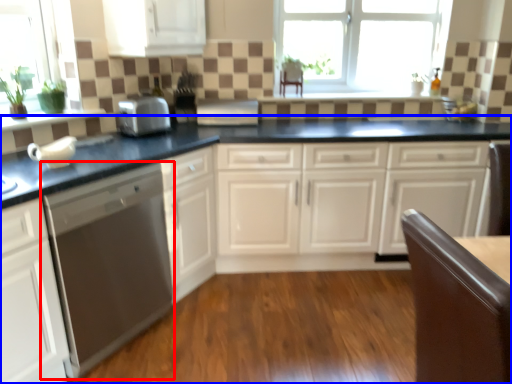
Question: Which point is closer to the camera, home appliance (highlighted by a red box) or countertop (highlighted by a blue box)?

Choices:
 (A) home appliance
 (B) countertop

Answer: (A)